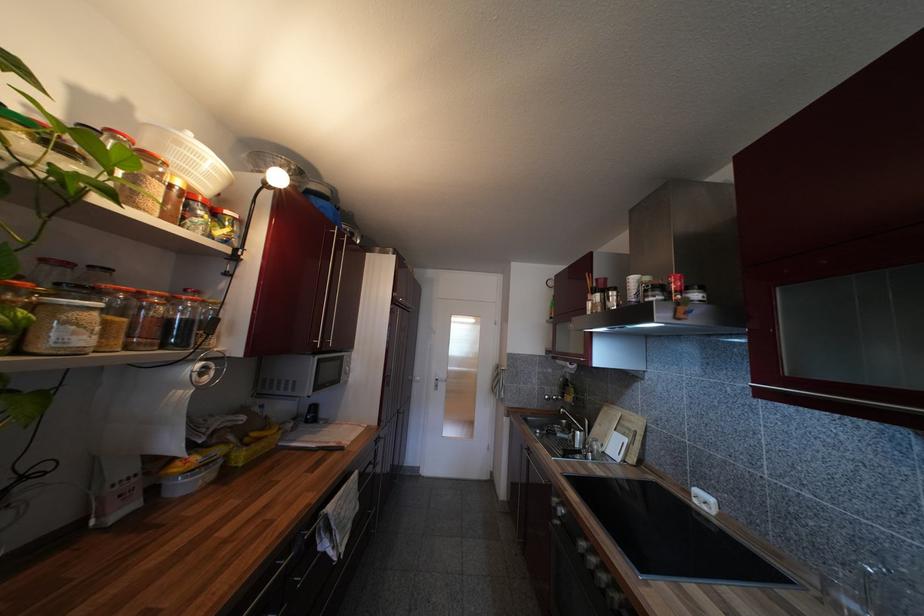
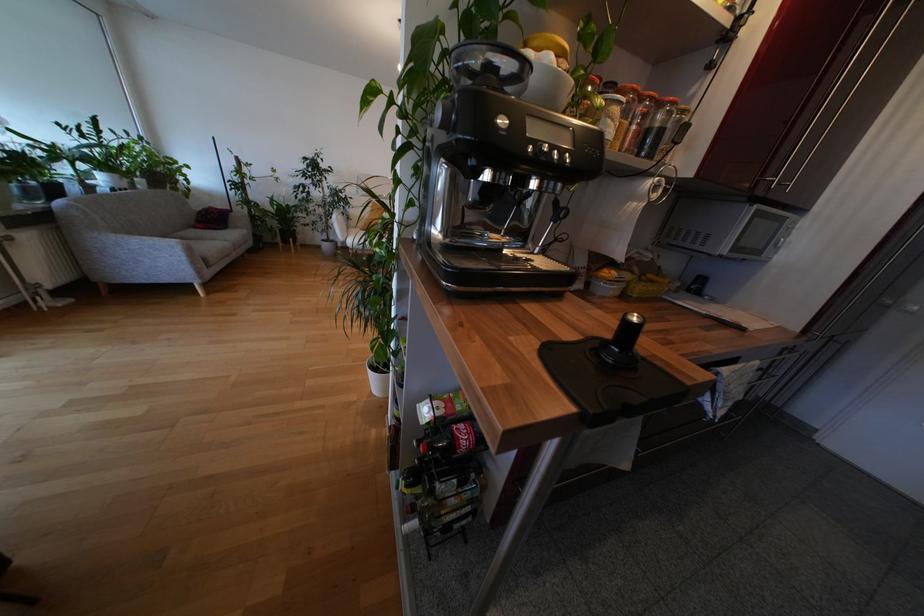
Based on the continuous images, in which direction is the camera rotating?

The camera rotated toward left-down.